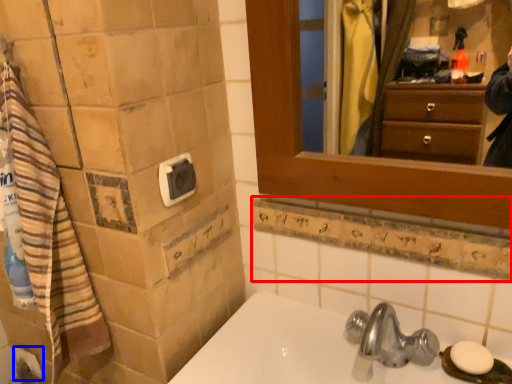
Question: Which of the following is the farthest to the observer, ledge (highlighted by a red box) or toilet paper (highlighted by a blue box)?

Choices:
 (A) ledge
 (B) toilet paper

Answer: (B)